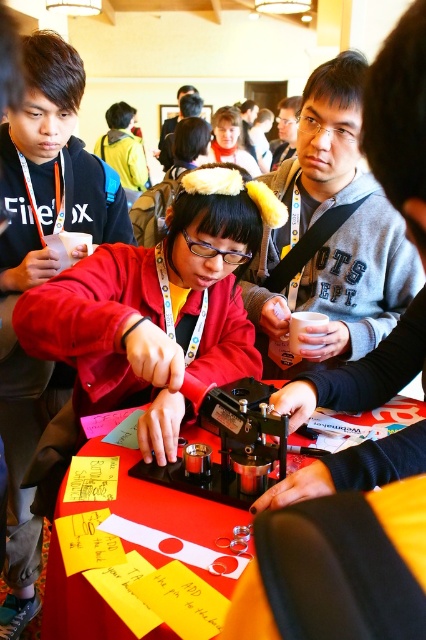
In the scene shown: You are a photographer at the event and need to capture a photo of the matte black shirt at center and the red plastic table at center. Which object should you focus on first if you want to ensure both are in sharp focus?

The matte black shirt at center is taller than the red plastic table at center, so you should focus on the matte black shirt at center first to ensure both are in sharp focus.

You are organizing a small workshop and need to place a gray fleece sweatshirt at center on the table. Can you confirm if the red plastic table at center is large enough to accommodate the sweatshirt?

The gray fleece sweatshirt at center is bigger than the red plastic table at center, so the table may not be large enough to fully accommodate the sweatshirt.

You are standing at the center of the room and want to take a photo of both the point at coordinates point (241,342) and point (77,204). Since you can only focus on one point at a time, which point should you focus on to ensure the other is still in the frame?

You should focus on point (241,342) because it is closer to the camera than point (77,204), so keeping it in focus will naturally include the farther point in the frame as well.